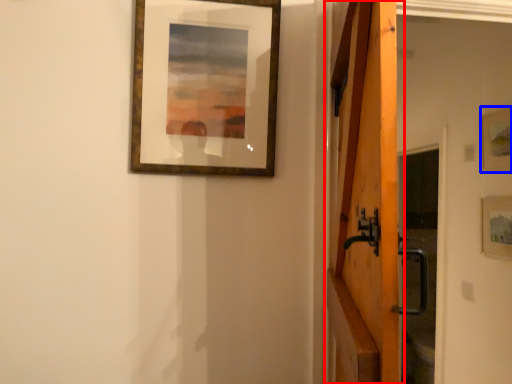
Question: Which of the following is the closest to the observer, barn door (highlighted by a red box) or picture frame (highlighted by a blue box)?

Choices:
 (A) barn door
 (B) picture frame

Answer: (A)